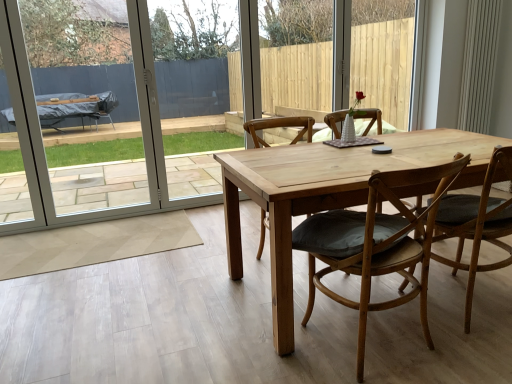
What do you see at coordinates (97, 107) in the screenshot? The width and height of the screenshot is (512, 384). I see `white plastic screen door at left` at bounding box center [97, 107].

Find the location of a particular element. light brown wooden chair at center, which is counted as the 1th chair, starting from the right is located at coordinates (476, 224).

This screenshot has width=512, height=384. Describe the element at coordinates (279, 127) in the screenshot. I see `light brown wooden chair at center, which ranks as the 1th chair in left-to-right order` at that location.

The height and width of the screenshot is (384, 512). In order to click on wooden chair with cushion at center, placed as the 2th chair when sorted from left to right in this screenshot , I will do `click(377, 244)`.

From the image's perspective, between white plastic screen door at left and light brown wooden chair at center, which ranks as the 1th chair in left-to-right order, which one is located above?

From the image's view, white plastic screen door at left is above.

From a real-world perspective, is white plastic screen door at left physically below light brown wooden chair at center, placed as the third chair when sorted from right to left?

Actually, white plastic screen door at left is physically above light brown wooden chair at center, placed as the third chair when sorted from right to left, in the real world.

From their relative heights in the image, would you say white plastic screen door at left is taller or shorter than light brown wooden chair at center, placed as the third chair when sorted from right to left?

Clearly, white plastic screen door at left is taller compared to light brown wooden chair at center, placed as the third chair when sorted from right to left.

Considering the sizes of objects wooden chair with cushion at center, placed as the 2th chair when sorted from left to right, and white plastic screen door at left in the image provided, who is shorter, wooden chair with cushion at center, placed as the 2th chair when sorted from left to right, or white plastic screen door at left?

With less height is wooden chair with cushion at center, placed as the 2th chair when sorted from left to right.

From the image's perspective, between wooden chair with cushion at center, placed as the 2th chair when sorted from left to right, and white plastic screen door at left, which one is located above?

white plastic screen door at left appears higher in the image.

Which object is further away from the camera taking this photo, wooden chair with cushion at center, placed as the 2th chair when sorted from left to right, or white plastic screen door at left?

Positioned behind is white plastic screen door at left.

From a real-world perspective, which object rests below the other?

wooden chair with cushion at center, the second chair from the right, is physically lower.

Based on the photo, does light brown wooden chair at center, placed as the third chair when sorted from right to left, have a lesser height compared to white plastic screen door at left?

Correct, light brown wooden chair at center, placed as the third chair when sorted from right to left, is not as tall as white plastic screen door at left.

Starting from the white plastic screen door at left, which chair is the 1st one to the right? Please provide its 2D coordinates.

[(279, 127)]

Could you measure the distance between light brown wooden chair at center, which ranks as the 1th chair in left-to-right order, and white plastic screen door at left?

light brown wooden chair at center, which ranks as the 1th chair in left-to-right order, is 3.97 meters from white plastic screen door at left.

Which is more distant, (310, 141) or (167, 208)?

The point (167, 208) is farther.

Is light brown wooden chair at center, which is counted as the 1th chair, starting from the right, bigger or smaller than light brown wooden chair at center, placed as the third chair when sorted from right to left?

In the image, light brown wooden chair at center, which is counted as the 1th chair, starting from the right, appears to be larger than light brown wooden chair at center, placed as the third chair when sorted from right to left.

Is light brown wooden chair at center, which is counted as the 1th chair, starting from the right, inside the boundaries of light brown wooden chair at center, placed as the third chair when sorted from right to left, or outside?

light brown wooden chair at center, which is counted as the 1th chair, starting from the right, is not inside light brown wooden chair at center, placed as the third chair when sorted from right to left, it's outside.

Considering the relative sizes of light brown wooden chair at center, which is counted as the 1th chair, starting from the right, and light brown wooden chair at center, which ranks as the 1th chair in left-to-right order, in the image provided, is light brown wooden chair at center, which is counted as the 1th chair, starting from the right, wider than light brown wooden chair at center, which ranks as the 1th chair in left-to-right order,?

Yes, light brown wooden chair at center, which is counted as the 1th chair, starting from the right, is wider than light brown wooden chair at center, which ranks as the 1th chair in left-to-right order.

Considering the relative positions of light brown wooden chair at center, arranged as the third chair when viewed from the left, and light brown wooden chair at center, placed as the third chair when sorted from right to left, in the image provided, is light brown wooden chair at center, arranged as the third chair when viewed from the left, to the left of light brown wooden chair at center, placed as the third chair when sorted from right to left, from the viewer's perspective?

In fact, light brown wooden chair at center, arranged as the third chair when viewed from the left, is to the right of light brown wooden chair at center, placed as the third chair when sorted from right to left.

From a real-world perspective, which object stands above the other?

light brown wooden chair at center, arranged as the third chair when viewed from the left.

In the scene shown: From the image's perspective, is wooden chair with cushion at center, placed as the 2th chair when sorted from left to right, located beneath light brown wooden chair at center, which is counted as the 1th chair, starting from the right?

Yes.

Is wooden chair with cushion at center, the second chair from the right, positioned in front of light brown wooden chair at center, which is counted as the 1th chair, starting from the right?

Yes, the depth of wooden chair with cushion at center, the second chair from the right, is less than that of light brown wooden chair at center, which is counted as the 1th chair, starting from the right.

Does point (334, 230) come in front of point (484, 214)?

Yes, point (334, 230) is in front of point (484, 214).

Consider the image. Is light brown wooden chair at center, arranged as the third chair when viewed from the left, far away from white plastic screen door at left?

Yes, light brown wooden chair at center, arranged as the third chair when viewed from the left, and white plastic screen door at left are located far from each other.

Does point (504, 236) come closer to viewer compared to point (122, 35)?

Yes, point (504, 236) is in front of point (122, 35).

From the white plastic screen door at left, count 3rd chair to the right and point to it. Please provide its 2D coordinates.

[(476, 224)]

Measure the distance between light brown wooden chair at center, which is counted as the 1th chair, starting from the right, and white plastic screen door at left.

light brown wooden chair at center, which is counted as the 1th chair, starting from the right, and white plastic screen door at left are 4.75 meters apart from each other.

Is white plastic screen door at left surrounding light brown wooden chair at center, which is counted as the 1th chair, starting from the right?

Actually, light brown wooden chair at center, which is counted as the 1th chair, starting from the right, is outside white plastic screen door at left.

Is point (83, 181) in front of point (483, 194)?

No, it is not.

From a real-world perspective, which is physically above, white plastic screen door at left or light brown wooden chair at center, arranged as the third chair when viewed from the left?

white plastic screen door at left.

Find the location of `the 2nd chair below the white plastic screen door at left (from a real-world perspective)`. the 2nd chair below the white plastic screen door at left (from a real-world perspective) is located at coordinates (279, 127).

Find the location of a particular element. The width and height of the screenshot is (512, 384). the 3rd chair below the white plastic screen door at left (from the image's perspective) is located at coordinates (377, 244).

Estimate the real-world distances between objects in this image. Which object is closer to light brown wooden chair at center, which is counted as the 1th chair, starting from the right, white plastic screen door at left or light brown wooden chair at center, placed as the third chair when sorted from right to left?

light brown wooden chair at center, placed as the third chair when sorted from right to left, is closer to light brown wooden chair at center, which is counted as the 1th chair, starting from the right.

Estimate the real-world distances between objects in this image. Which object is closer to light brown wooden chair at center, placed as the third chair when sorted from right to left, white plastic screen door at left or light brown wooden chair at center, arranged as the third chair when viewed from the left?

Among the two, light brown wooden chair at center, arranged as the third chair when viewed from the left, is located nearer to light brown wooden chair at center, placed as the third chair when sorted from right to left.

When comparing their distances from white plastic screen door at left, does light brown wooden chair at center, which ranks as the 1th chair in left-to-right order, or light brown wooden chair at center, arranged as the third chair when viewed from the left, seem further?

Among the two, light brown wooden chair at center, arranged as the third chair when viewed from the left, is located further to white plastic screen door at left.

When comparing their distances from light brown wooden chair at center, placed as the third chair when sorted from right to left, does wooden chair with cushion at center, the second chair from the right, or white plastic screen door at left seem further?

The object further to light brown wooden chair at center, placed as the third chair when sorted from right to left, is white plastic screen door at left.

Looking at the image, which one is located closer to white plastic screen door at left, wooden chair with cushion at center, placed as the 2th chair when sorted from left to right, or light brown wooden chair at center, arranged as the third chair when viewed from the left?

wooden chair with cushion at center, placed as the 2th chair when sorted from left to right.

When comparing their distances from white plastic screen door at left, does light brown wooden chair at center, arranged as the third chair when viewed from the left, or wooden chair with cushion at center, placed as the 2th chair when sorted from left to right, seem further?

The object further to white plastic screen door at left is light brown wooden chair at center, arranged as the third chair when viewed from the left.

Considering their positions, is wooden chair with cushion at center, placed as the 2th chair when sorted from left to right, positioned closer to light brown wooden chair at center, which ranks as the 1th chair in left-to-right order, than light brown wooden chair at center, arranged as the third chair when viewed from the left?

light brown wooden chair at center, arranged as the third chair when viewed from the left, is closer to light brown wooden chair at center, which ranks as the 1th chair in left-to-right order.

Based on the photo, from the image, which object appears to be farther from wooden chair with cushion at center, placed as the 2th chair when sorted from left to right, light brown wooden chair at center, which ranks as the 1th chair in left-to-right order, or light brown wooden chair at center, which is counted as the 1th chair, starting from the right?

Among the two, light brown wooden chair at center, which ranks as the 1th chair in left-to-right order, is located further to wooden chair with cushion at center, placed as the 2th chair when sorted from left to right.

Locate an element on the screen. The width and height of the screenshot is (512, 384). chair between white plastic screen door at left and wooden chair with cushion at center, placed as the 2th chair when sorted from left to right, in the horizontal direction is located at coordinates point(279,127).

Identify the location of chair located between light brown wooden chair at center, placed as the third chair when sorted from right to left, and light brown wooden chair at center, which is counted as the 1th chair, starting from the right, in the left-right direction. click(377, 244).